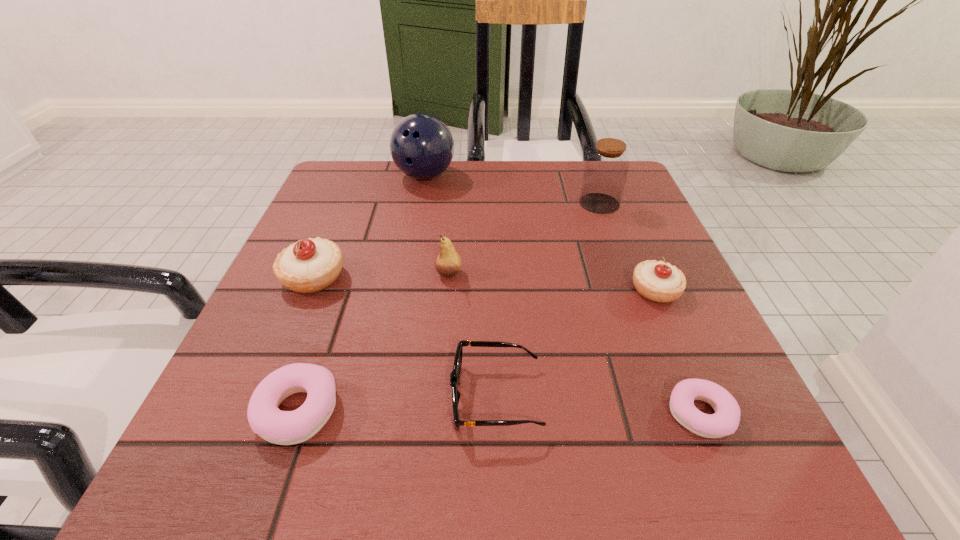
This screenshot has width=960, height=540. I want to click on the third tallest pastry, so [265, 418].

I want to click on the bigger pink pastry, so click(265, 418).

You are a GUI agent. You are given a task and a screenshot of the screen. Output one action in this format:
    pyautogui.click(x=<x>, y=<y>)
    Task: Click on the shortest pastry
    The width and height of the screenshot is (960, 540).
    Given the screenshot: What is the action you would take?
    pyautogui.click(x=725, y=421)

At what (x,y) coordinates should I click in order to perform the action: click on the smaller pink pastry. Please return your answer as a coordinate pair (x, y). Looking at the image, I should click on (725, 421).

Where is `vacant space located 0.070m on the surface of the farthest object near the finger holes`? vacant space located 0.070m on the surface of the farthest object near the finger holes is located at coordinates (419, 208).

This screenshot has width=960, height=540. What are the coordinates of `free space located 0.310m on the front of the jar` in the screenshot? It's located at [x=641, y=317].

What are the coordinates of `vacant space situated 0.080m on the left of the pear` in the screenshot? It's located at (394, 274).

Identify the location of vacant space positioned on the right of the bigger beige pastry. This screenshot has height=540, width=960. (474, 277).

Where is `vacant region located 0.280m on the back of the third shortest pastry`? Image resolution: width=960 pixels, height=540 pixels. vacant region located 0.280m on the back of the third shortest pastry is located at coordinates (615, 195).

Locate an element on the screen. free region located 0.290m on the front-facing side of the sunglasses is located at coordinates pyautogui.click(x=250, y=397).